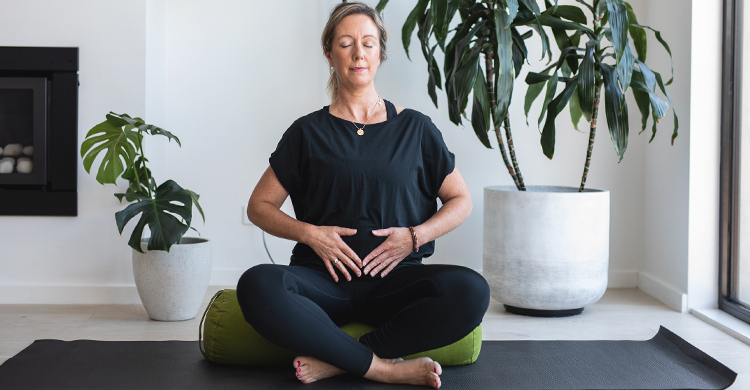
This screenshot has width=750, height=390. I want to click on white cord, so click(265, 244).